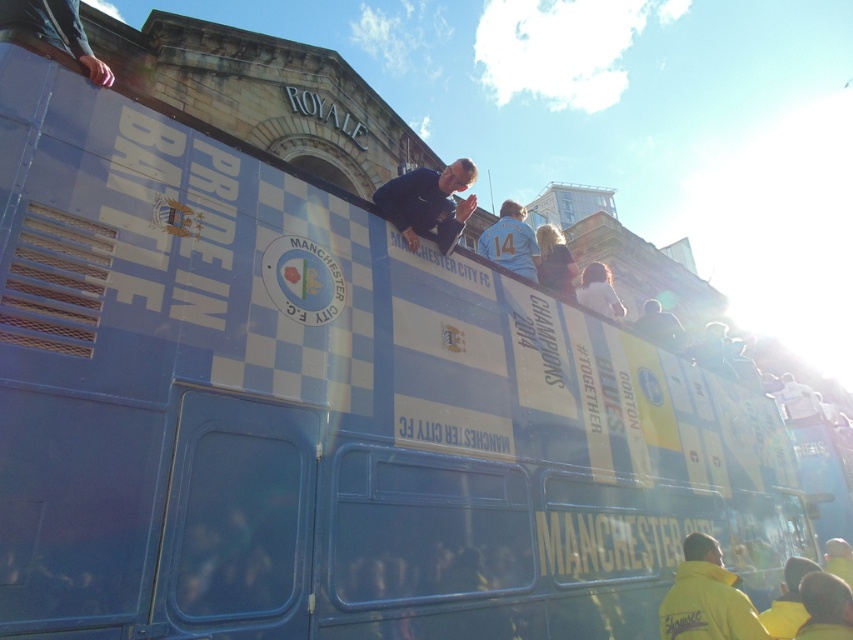
Who is shorter, blue fabric jacket at center or white jersey at center?

blue fabric jacket at center

Between blue fabric jacket at center and white jersey at center, which one is positioned lower?

Positioned lower is blue fabric jacket at center.

Where is `blue fabric jacket at center`? The height and width of the screenshot is (640, 853). blue fabric jacket at center is located at coordinates (428, 202).

In order to click on blue fabric jacket at center in this screenshot , I will do `click(428, 202)`.

Does yellow matte jacket at lower right appear on the right side of white jersey at center?

No, yellow matte jacket at lower right is not to the right of white jersey at center.

Is yellow matte jacket at lower right wider than white jersey at center?

In fact, yellow matte jacket at lower right might be narrower than white jersey at center.

Identify the location of yellow matte jacket at lower right. The image size is (853, 640). (706, 596).

I want to click on yellow matte jacket at lower right, so click(706, 596).

Can you confirm if yellow fabric person at lower right is wider than white jersey at center?

Incorrect, yellow fabric person at lower right's width does not surpass white jersey at center's.

Between yellow fabric person at lower right and white jersey at center, which one appears on the right side from the viewer's perspective?

yellow fabric person at lower right is more to the right.

Locate an element on the screen. This screenshot has width=853, height=640. yellow fabric person at lower right is located at coordinates (825, 608).

Where is `yellow fabric person at lower right`? yellow fabric person at lower right is located at coordinates (825, 608).